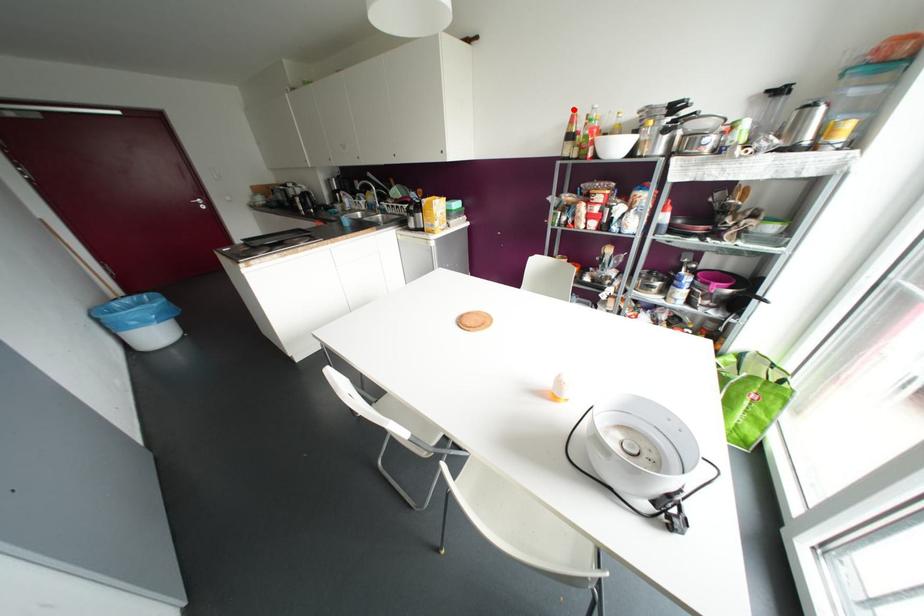
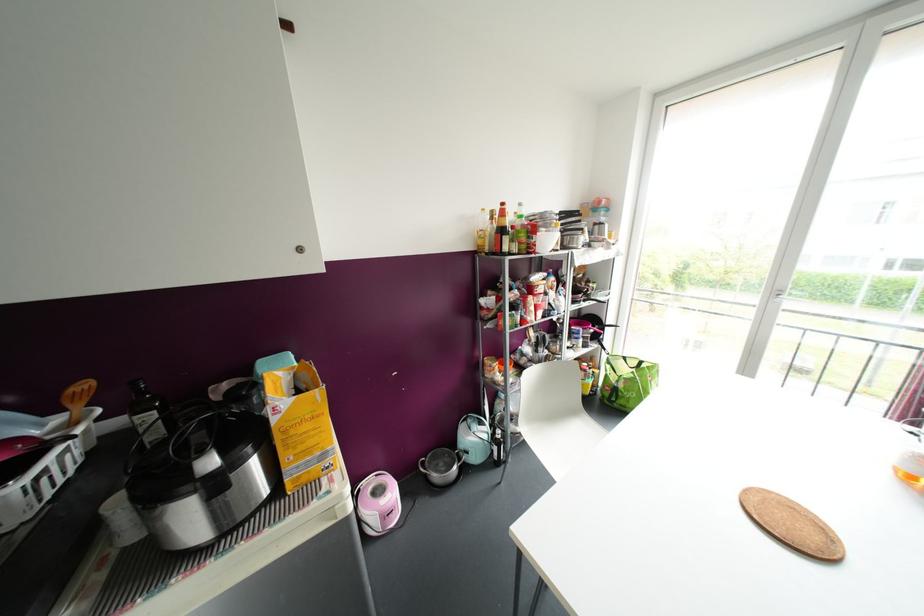
In the second image, find the point that corresponds to the highlighted location in the first image.

(502, 204)